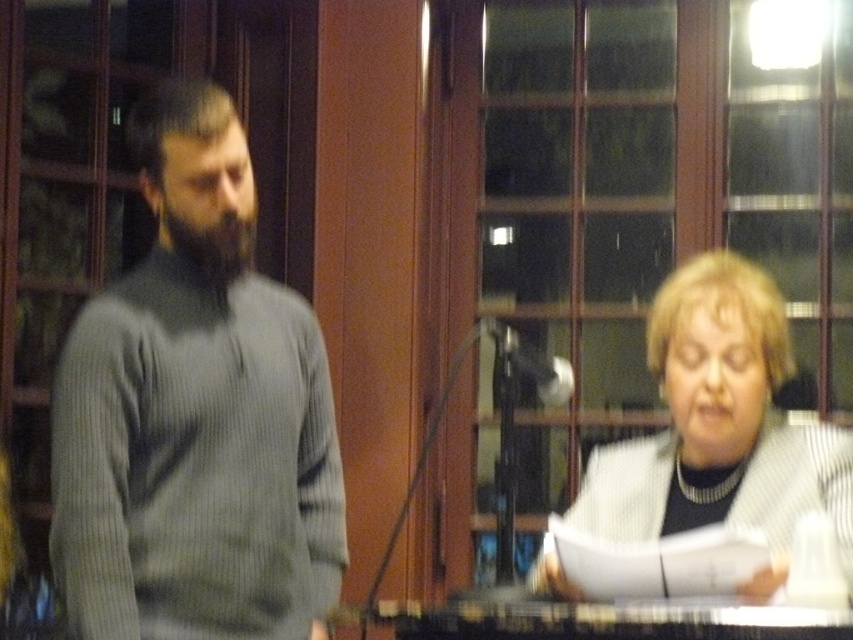
Question: Based on their relative distances, which object is farther from the black plastic table at lower center?

Choices:
 (A) white textured sweater at lower right
 (B) gray ribbed sweater at left

Answer: (B)

Question: Which point is closer to the camera?

Choices:
 (A) white textured sweater at lower right
 (B) black plastic table at lower center
 (C) gray ribbed sweater at left

Answer: (B)

Question: Does gray ribbed sweater at left have a larger size compared to white textured sweater at lower right?

Choices:
 (A) yes
 (B) no

Answer: (A)

Question: Which point is closer to the camera?

Choices:
 (A) white textured sweater at lower right
 (B) gray ribbed sweater at left
 (C) black plastic table at lower center

Answer: (C)

Question: Does gray ribbed sweater at left appear on the right side of white textured sweater at lower right?

Choices:
 (A) no
 (B) yes

Answer: (A)

Question: Is gray ribbed sweater at left thinner than black plastic table at lower center?

Choices:
 (A) no
 (B) yes

Answer: (B)